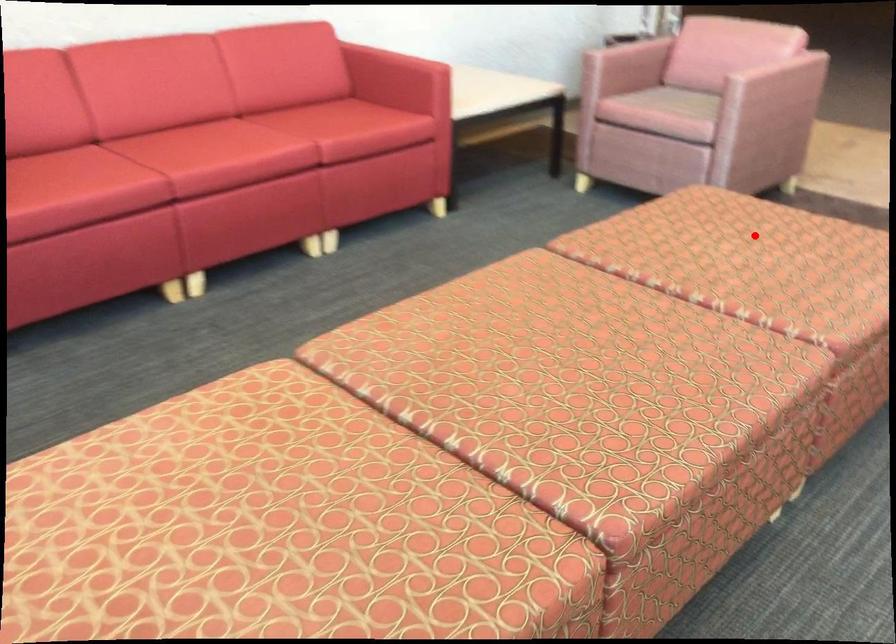
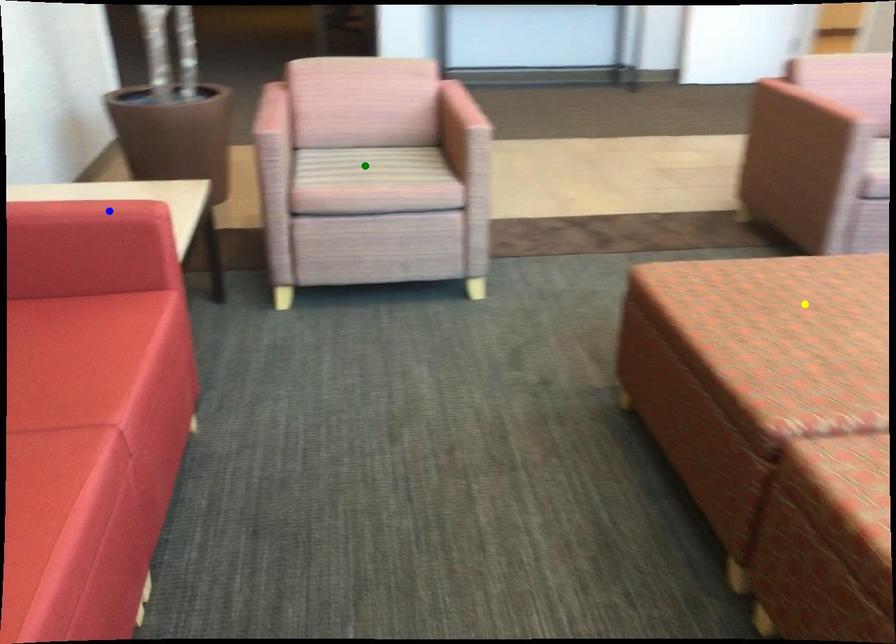
Question: I am providing you with two images of the same scene from different viewpoints. A red point is marked on the first image. You are given multiple points on the second image. Which point in image 2 is actually the same real-world point as the red point in image 1?

Choices:
 (A) blue point
 (B) green point
 (C) yellow point

Answer: (C)